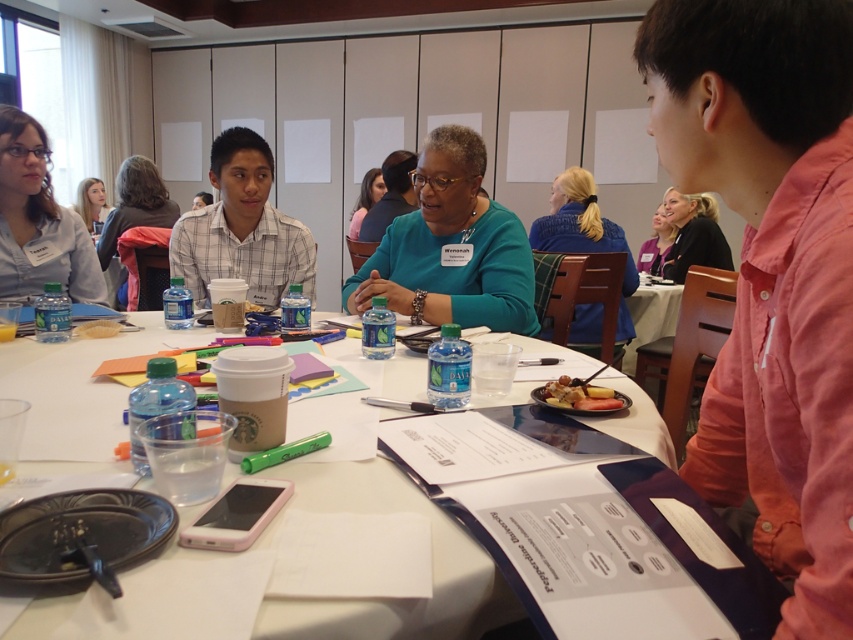
Question: Is matte black hair at upper left to the left of green matte sweater at center from the viewer's perspective?

Choices:
 (A) no
 (B) yes

Answer: (B)

Question: In this image, where is teal fabric shirt at center located relative to matte gray sweater at upper left?

Choices:
 (A) left
 (B) right

Answer: (B)

Question: In this image, where is matte gray sweater at upper left located relative to translucent plastic bag at table center?

Choices:
 (A) left
 (B) right

Answer: (A)

Question: Estimate the real-world distances between objects in this image. Which object is farther from the smooth brown bread at center?

Choices:
 (A) matte blue shirt at upper left
 (B) matte gray sweater at upper left
 (C) matte black hair at upper left

Answer: (C)

Question: Estimate the real-world distances between objects in this image. Which object is closer to the matte black hair at upper right?

Choices:
 (A) smooth brown bread at center
 (B) white plastic table at center
 (C) matte teal sweater at upper center

Answer: (C)

Question: Which point is farther to the camera?

Choices:
 (A) (651, 284)
 (B) (111, 326)
 (C) (651, 404)

Answer: (A)